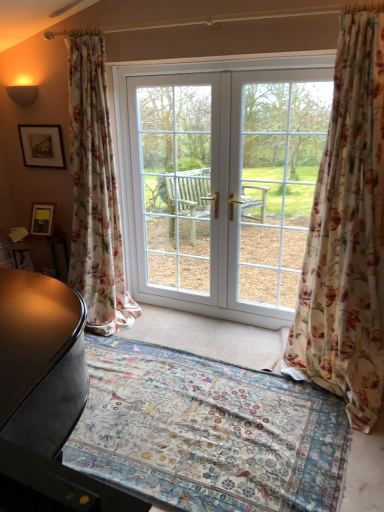
Where is `blank space above white glass door at center (from a real-world perspective)`? The image size is (384, 512). blank space above white glass door at center (from a real-world perspective) is located at coordinates (276, 71).